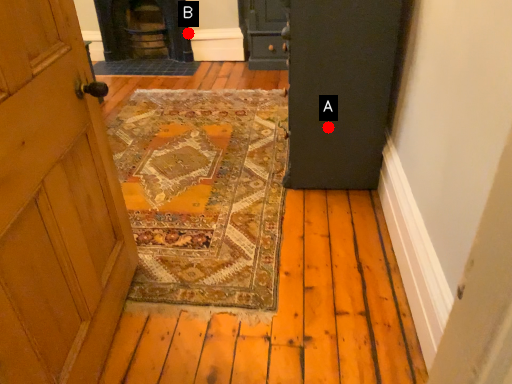
Question: Two points are circled on the image, labeled by A and B beside each circle. Which of the following is the farthest from the observer?

Choices:
 (A) A is further
 (B) B is further

Answer: (B)